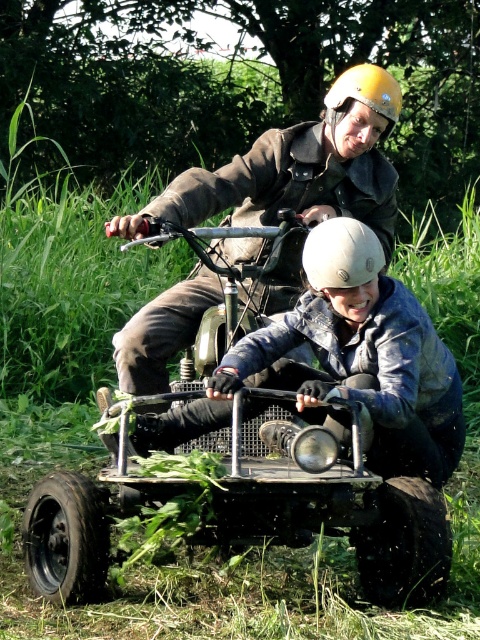
Question: Which point appears closest to the camera in this image?

Choices:
 (A) (441, 417)
 (B) (308, 262)
 (C) (376, 68)

Answer: (B)

Question: Which point is farther to the camera?

Choices:
 (A) (372, 68)
 (B) (152, 444)
 (C) (301, 256)

Answer: (C)

Question: Does white matte helmet at center appear on the left side of yellow matte helmet at upper center?

Choices:
 (A) yes
 (B) no

Answer: (A)

Question: Estimate the real-world distances between objects in this image. Which object is closer to the white matte helmet at center?

Choices:
 (A) matte black helmet at center
 (B) yellow matte helmet at upper center

Answer: (A)

Question: Is white matte helmet at center to the right of yellow matte helmet at upper center from the viewer's perspective?

Choices:
 (A) no
 (B) yes

Answer: (A)

Question: In this image, where is matte black helmet at center located relative to white matte helmet at center?

Choices:
 (A) below
 (B) above

Answer: (A)